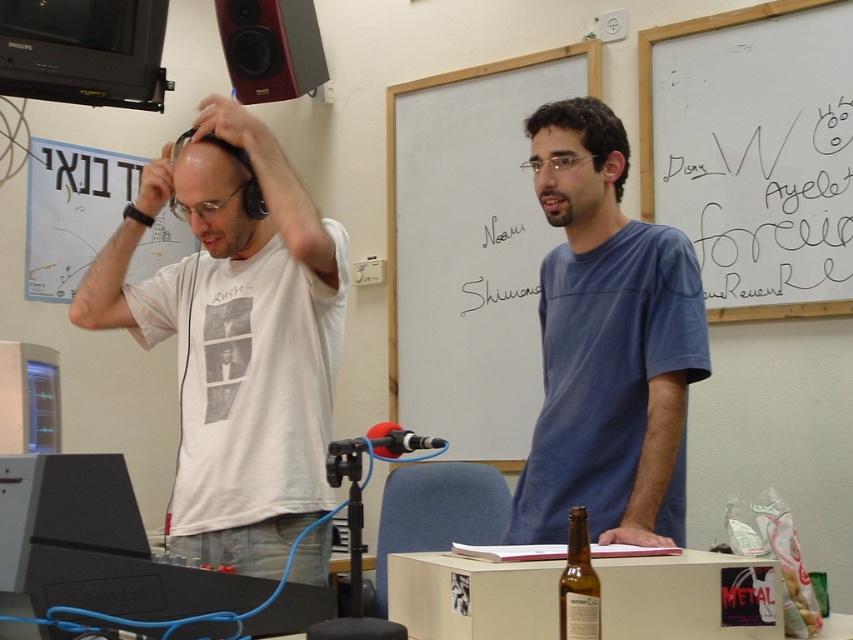
Question: Which point is farther from the camera taking this photo?

Choices:
 (A) (337, 456)
 (B) (761, 136)

Answer: (B)

Question: Does brown glass bottle at lower center appear on the left side of red foam microphone at center?

Choices:
 (A) no
 (B) yes

Answer: (A)

Question: Based on their relative distances, which object is farther from the brown glass bottle at lower center?

Choices:
 (A) matte red speaker at upper left
 (B) white matte t-shirt at left
 (C) red foam microphone at center

Answer: (A)

Question: Is white matte t-shirt at left wider than brown glass bottle at lower center?

Choices:
 (A) yes
 (B) no

Answer: (A)

Question: Which is farther from the brown glass bottle at lower center?

Choices:
 (A) matte red speaker at upper left
 (B) white matte chalkboard at center
 (C) black matte earphone at upper left
 (D) white matte t-shirt at left

Answer: (A)

Question: Can you confirm if matte red speaker at upper left is positioned to the left of brown glass bottle at lower center?

Choices:
 (A) no
 (B) yes

Answer: (B)